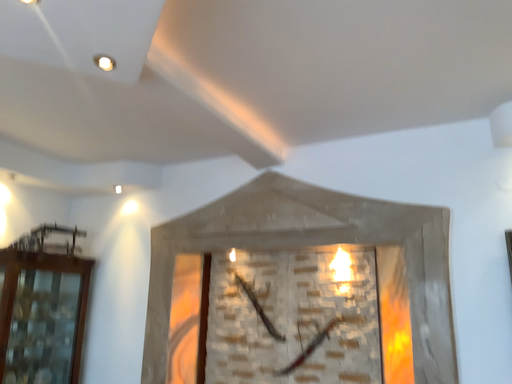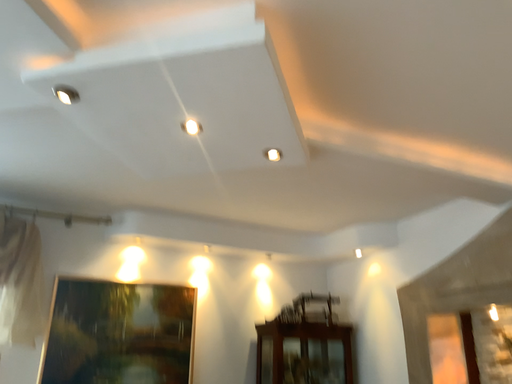
Question: How did the camera likely rotate when shooting the video?

Choices:
 (A) rotated left
 (B) rotated right

Answer: (A)